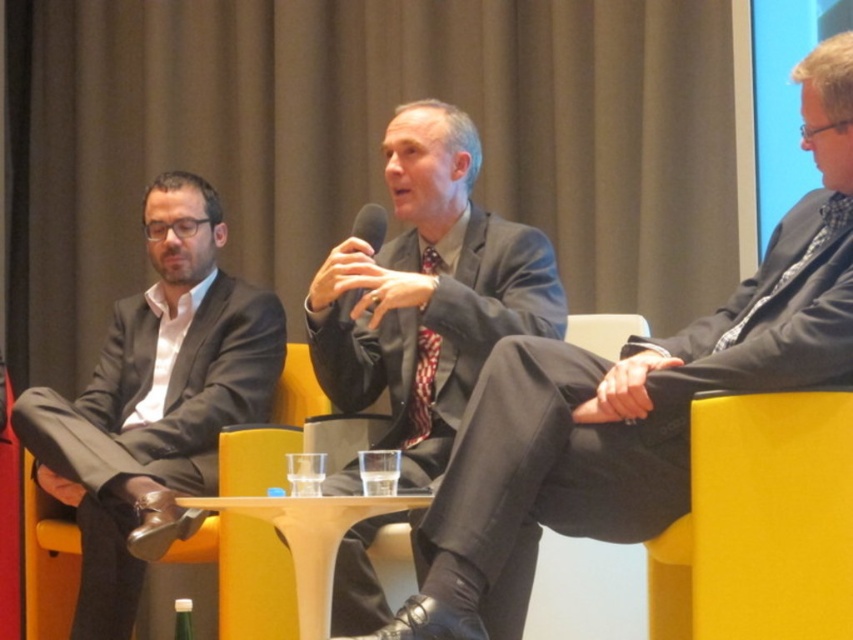
Who is positioned more to the left, matte black suit at left or matte gray suit at center?

matte black suit at left

Is point (236, 328) closer to viewer compared to point (469, 292)?

No, (236, 328) is further to viewer.

Between point (262, 301) and point (554, 337), which one is positioned behind?

The point (262, 301) is behind.

In order to click on matte black suit at left in this screenshot , I will do `click(154, 400)`.

Is point (381, 317) closer to viewer compared to point (370, 220)?

No, it is behind (370, 220).

Who is more forward, (320, 282) or (375, 227)?

Point (320, 282) is more forward.

I want to click on matte gray suit at center, so click(428, 291).

Does matte black suit at center have a smaller size compared to matte gray suit at center?

Incorrect, matte black suit at center is not smaller in size than matte gray suit at center.

Does matte black suit at center lie behind matte gray suit at center?

That is False.

Which is behind, point (848, 275) or point (416, 483)?

Point (416, 483)

I want to click on matte black suit at center, so click(x=631, y=403).